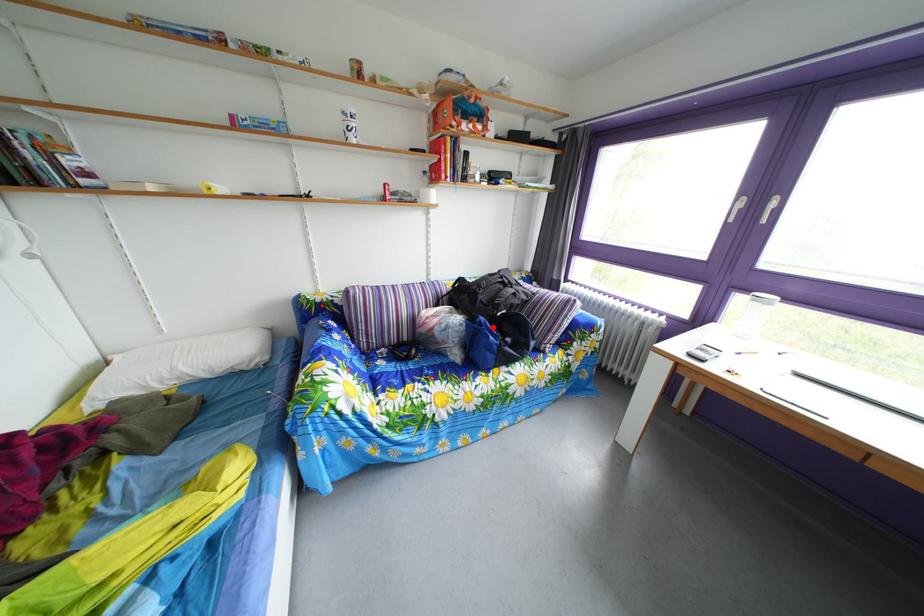
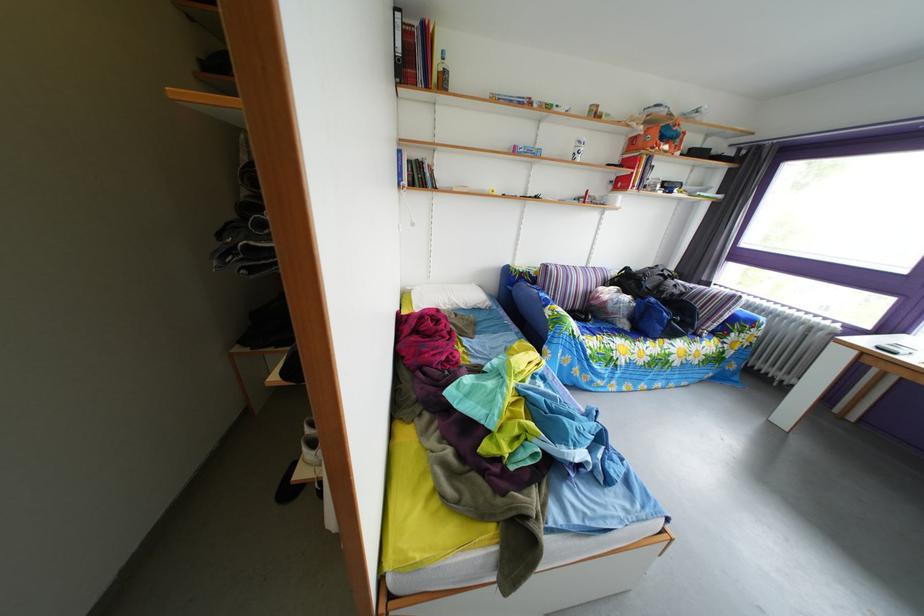
In the second image, find the point that corresponds to the highlighted location in the first image.

(663, 307)